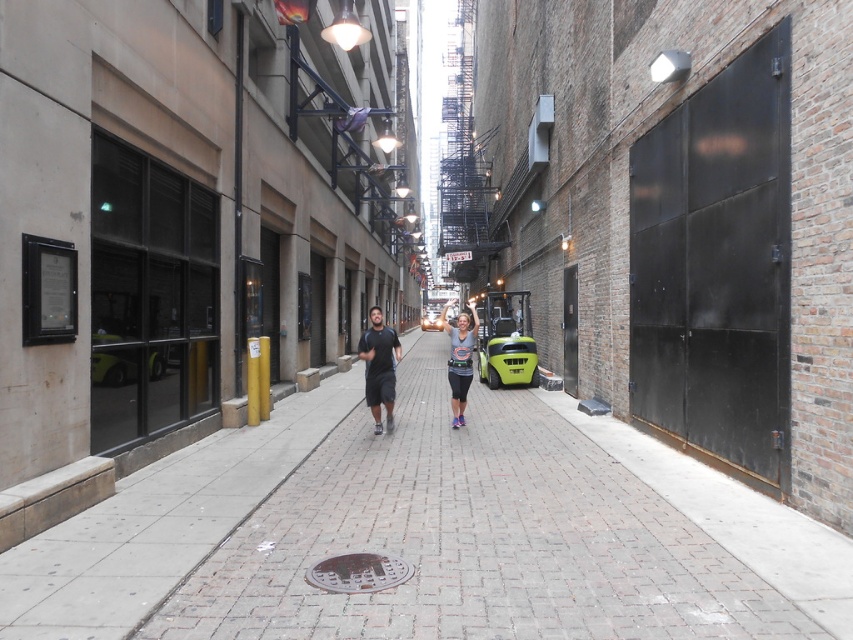
Between dark gray fabric shirt at center and shiny silver car at center, which one is positioned higher?

shiny silver car at center

Can you confirm if dark gray fabric shirt at center is thinner than shiny silver car at center?

Correct, dark gray fabric shirt at center's width is less than shiny silver car at center's.

Does point (387, 376) come closer to viewer compared to point (428, 314)?

Yes.

Where is `dark gray fabric shirt at center`? The image size is (853, 640). dark gray fabric shirt at center is located at coordinates (x=379, y=368).

Is brick pavement at center thinner than green matte forklift at center?

No.

Is brick pavement at center positioned behind green matte forklift at center?

No.

Which is behind, point (451, 477) or point (106, 339)?

Positioned behind is point (451, 477).

The image size is (853, 640). Identify the location of brick pavement at center. (514, 536).

Is point (456, 326) behind point (440, 326)?

No, it is not.

Is the position of gray cotton t-shirt at center more distant than that of shiny silver car at center?

No, it is not.

The image size is (853, 640). In order to click on gray cotton t-shirt at center in this screenshot , I will do `click(459, 356)`.

This screenshot has height=640, width=853. Find the location of `gray cotton t-shirt at center`. gray cotton t-shirt at center is located at coordinates (459, 356).